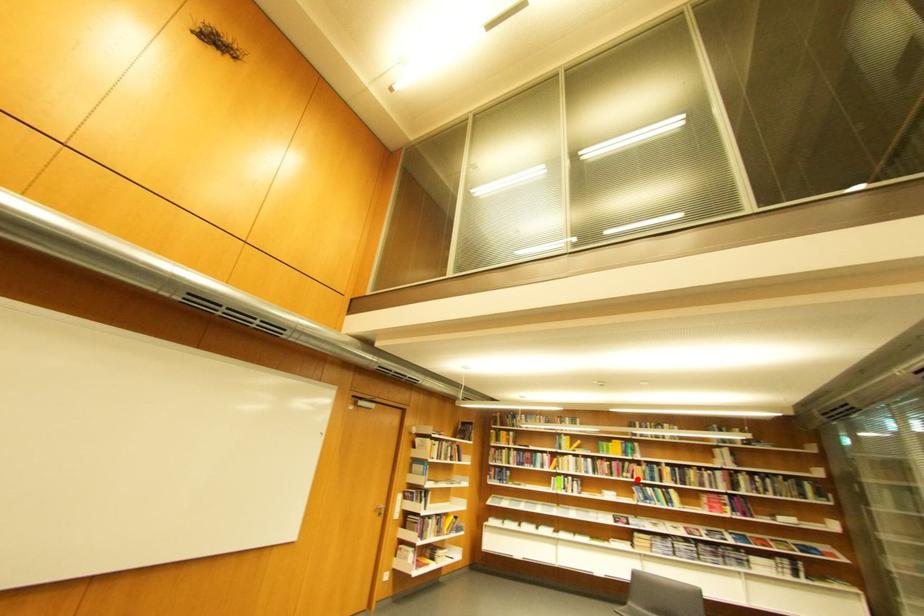
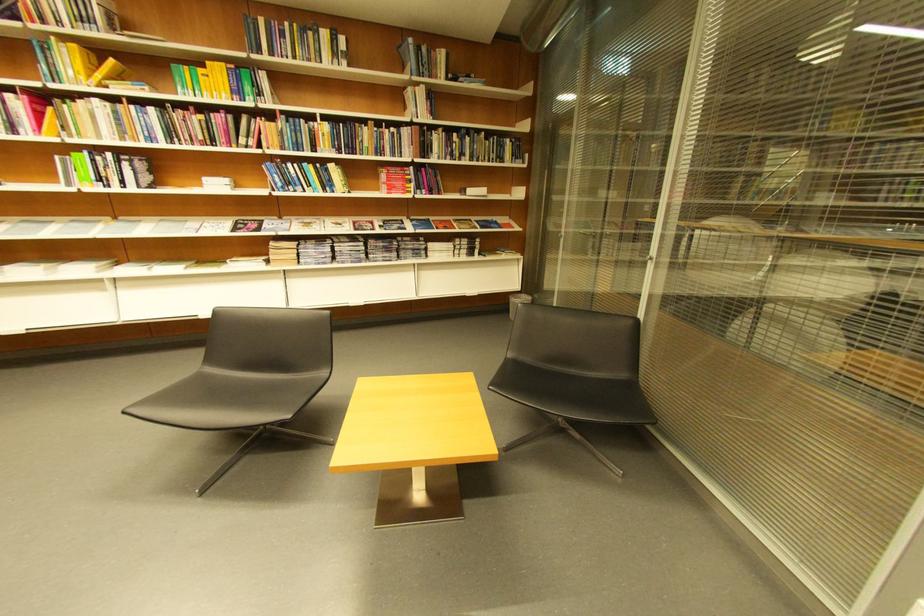
Locate, in the second image, the point that corresponds to the highlighted location in the first image.

(258, 148)